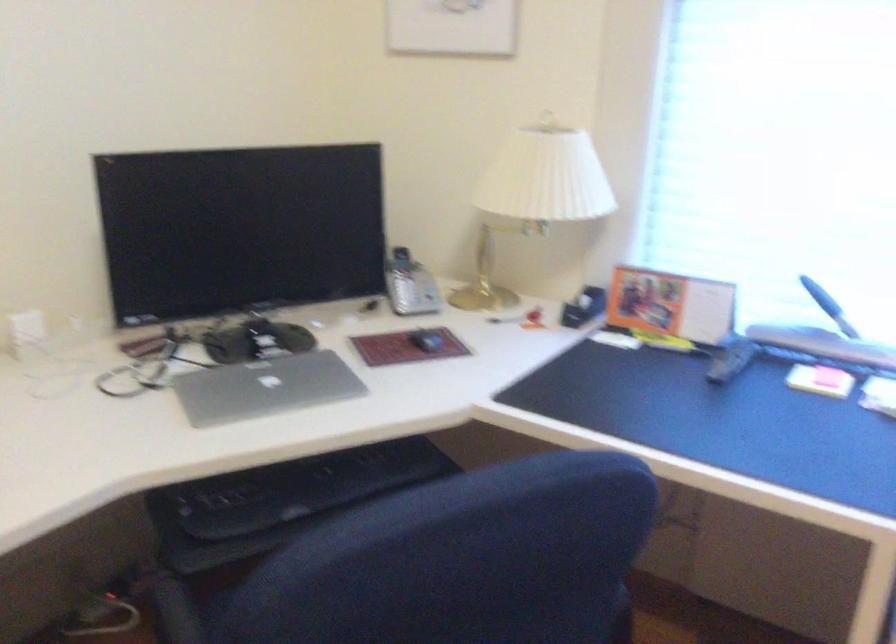
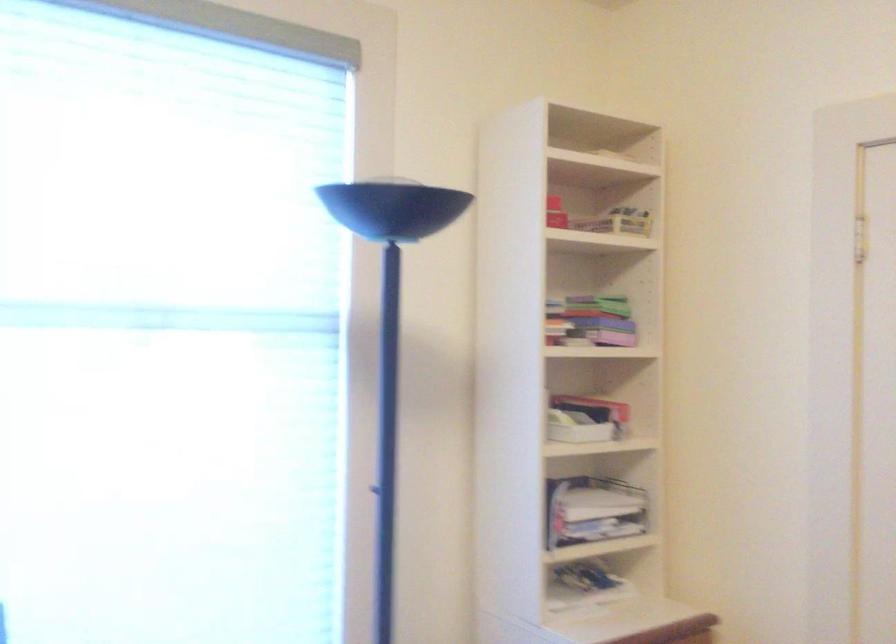
Question: How did the camera likely rotate?

Choices:
 (A) Left
 (B) Right
 (C) Up
 (D) Down

Answer: (B)